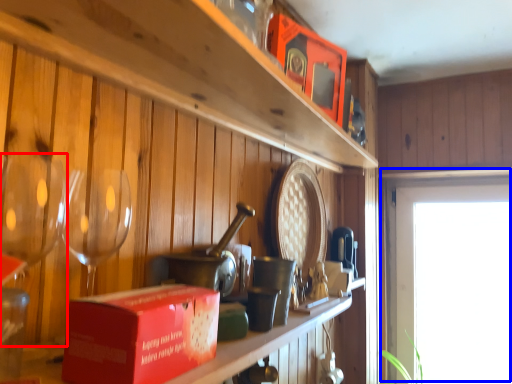
Question: Which point is further to the camera, wine glass (highlighted by a red box) or window (highlighted by a blue box)?

Choices:
 (A) wine glass
 (B) window

Answer: (B)